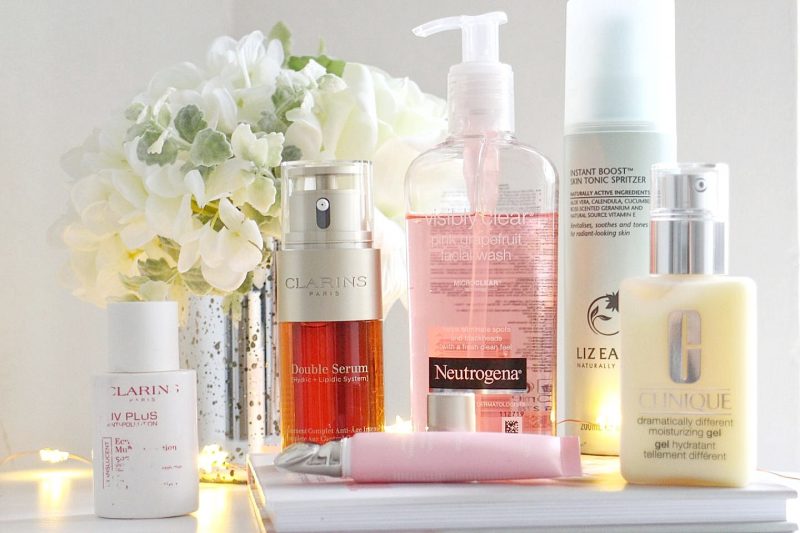
Locate an element on the screen. The height and width of the screenshot is (533, 800). book is located at coordinates (700, 510).